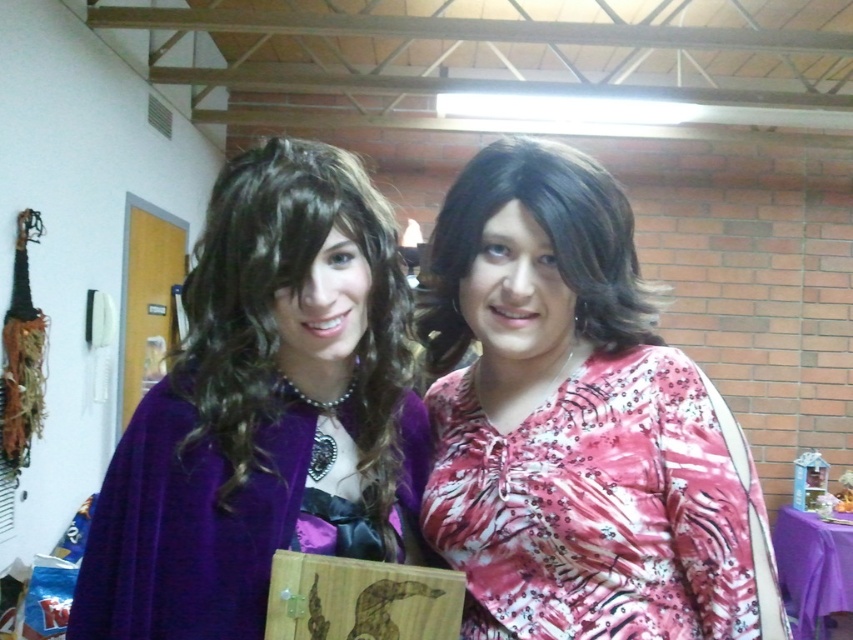
You are a photographer setting up for a photoshoot and need to position a light source to the right of both the velvet purple cape at left and the shiny brown wig at center. Based on their positions, which object should the light be placed to the right of first?

The light should be placed to the right of the shiny brown wig at center first because the velvet purple cape at left is already to the left of the shiny brown wig at center, so positioning the light to the right of the wig ensures it is also to the right of the cape.

You are a photographer taking a photo of the two people in the scene. The pink sequined blouse at center and the velvet purple cape at left are both in the frame. Based on their heights, which one is more likely to block the view of the other?

The pink sequined blouse at center is much taller than the velvet purple cape at left, so it is more likely to block the view of the velvet purple cape at left.